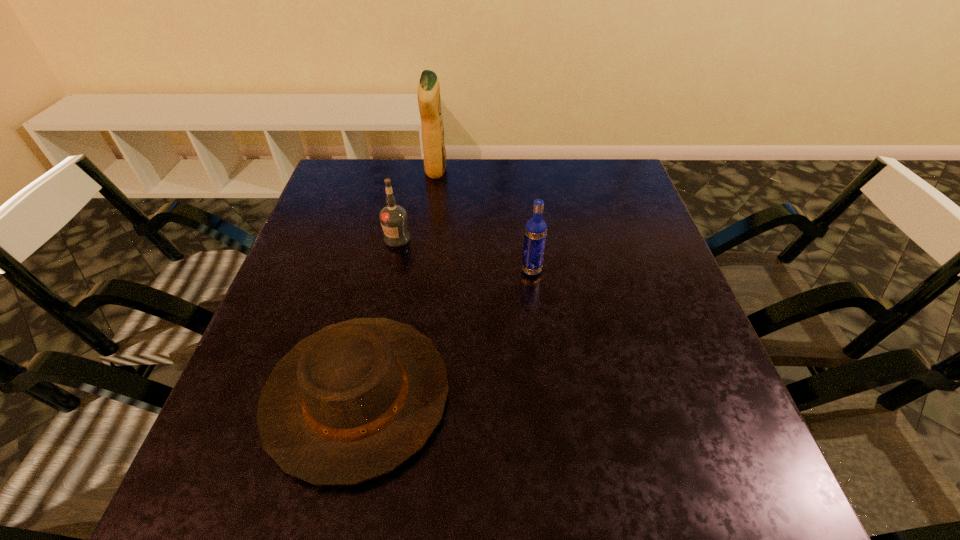
Identify the location of free location located on the front label of the second farthest object. The width and height of the screenshot is (960, 540). (382, 309).

Locate an element on the screen. free spot located 0.350m on the back of the shortest object is located at coordinates (396, 220).

Where is `object present at the far edge`? object present at the far edge is located at coordinates (429, 101).

I want to click on object present at the near edge, so click(353, 401).

Locate an element on the screen. The height and width of the screenshot is (540, 960). object that is at the left edge is located at coordinates (353, 401).

Locate an element on the screen. The width and height of the screenshot is (960, 540). object located in the near left corner section of the desktop is located at coordinates (353, 401).

Where is `vacant space at the far edge`? vacant space at the far edge is located at coordinates (470, 199).

The image size is (960, 540). In the image, there is a desktop. Find the location of `vacant space at the near edge`. vacant space at the near edge is located at coordinates (330, 518).

Find the location of a particular element. This screenshot has height=540, width=960. free region at the left edge is located at coordinates (241, 418).

In the image, there is a desktop. Identify the location of vacant space at the right edge. This screenshot has height=540, width=960. (662, 420).